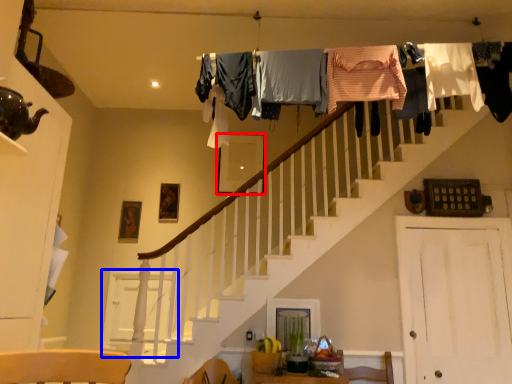
Question: Which object is further to the camera taking this photo, picture frame (highlighted by a red box) or barn door (highlighted by a blue box)?

Choices:
 (A) picture frame
 (B) barn door

Answer: (A)